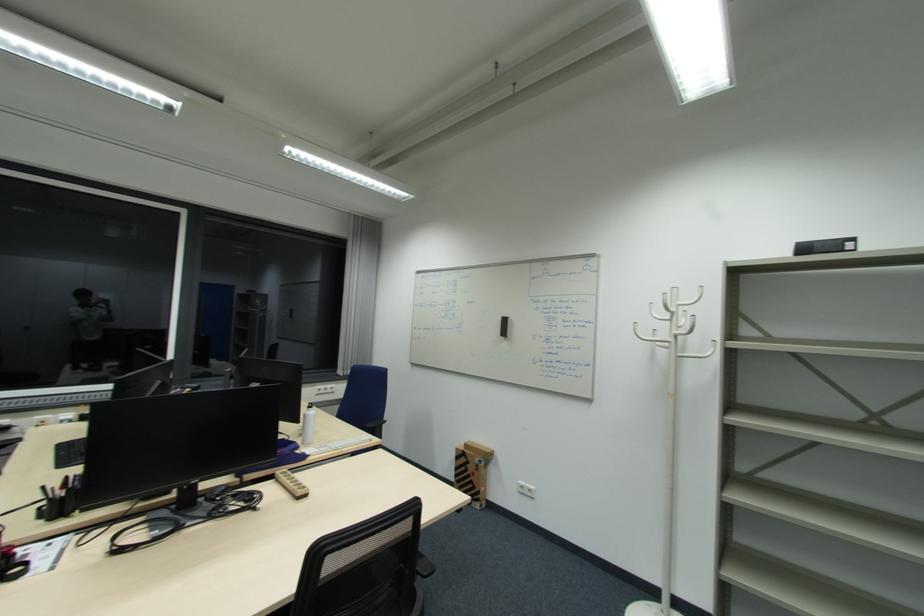
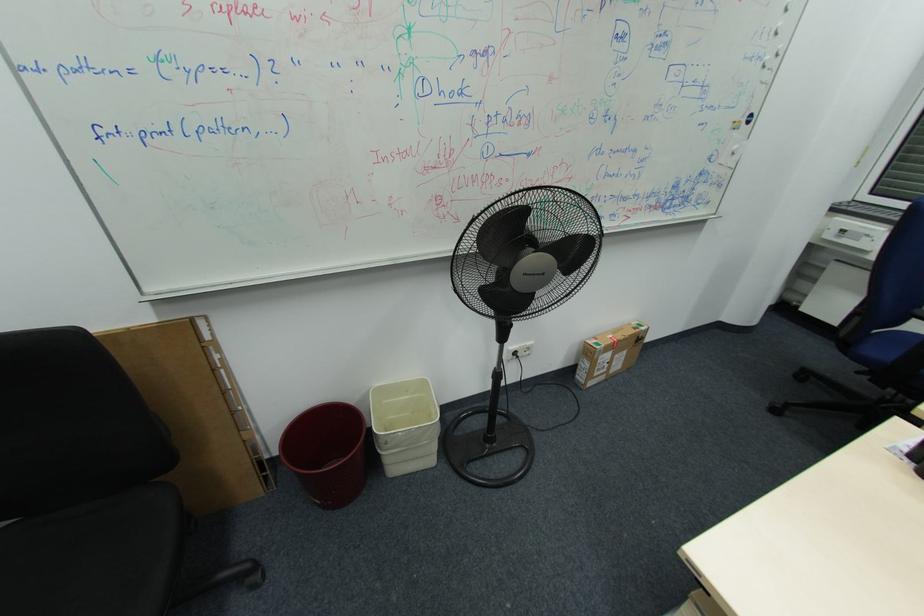
Based on the continuous images, in which direction is the camera rotating?

The camera rotated toward left-down.